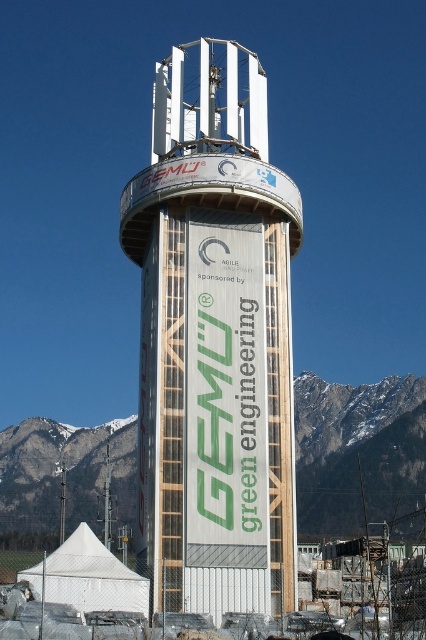
Question: Which object is closer to the camera taking this photo?

Choices:
 (A) snowy rocky mountain at center
 (B) wooden tower at center

Answer: (B)

Question: Does wooden tower at center appear on the left side of snowy rocky mountain at center?

Choices:
 (A) yes
 (B) no

Answer: (A)

Question: In this image, where is wooden tower at center located relative to snowy rocky mountain at center?

Choices:
 (A) below
 (B) above

Answer: (B)

Question: Where is wooden tower at center located in relation to snowy rocky mountain at center in the image?

Choices:
 (A) left
 (B) right

Answer: (A)

Question: Which object appears closest to the camera in this image?

Choices:
 (A) wooden tower at center
 (B) snowy rocky mountain at center

Answer: (A)